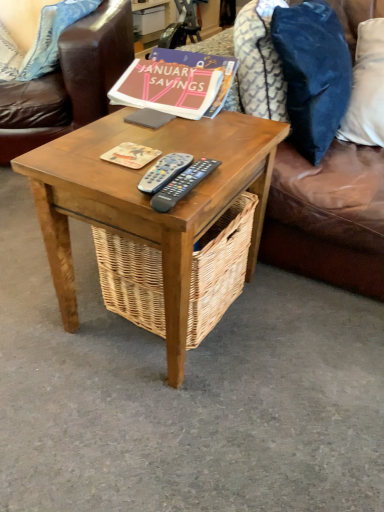
You are a GUI agent. You are given a task and a screenshot of the screen. Output one action in this format:
    pyautogui.click(x=<x>, y=<y>)
    Task: Click on the free space behind black plastic remote control at center, the first remote control viewed from the right
    Image resolution: width=384 pixels, height=512 pixels.
    Given the screenshot: What is the action you would take?
    pyautogui.click(x=192, y=143)